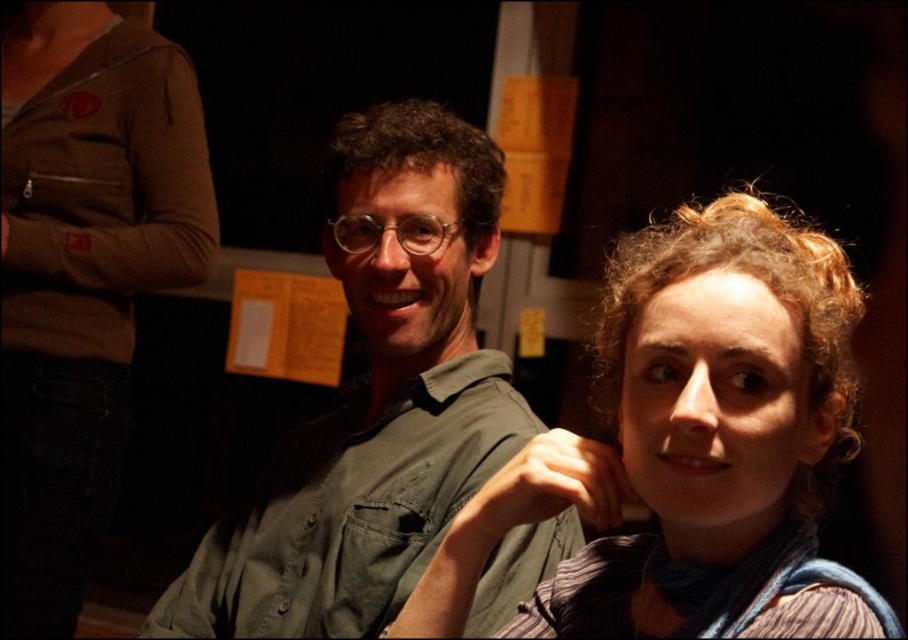
Between green matte shirt at center and curly hair at center, which one is positioned higher?

green matte shirt at center is higher up.

Find the location of a particular element. This screenshot has width=908, height=640. green matte shirt at center is located at coordinates (374, 401).

Where is `green matte shirt at center`? green matte shirt at center is located at coordinates (374, 401).

Is curly hair at center closer to the viewer compared to brown zippered jacket at upper left?

Yes, curly hair at center is in front of brown zippered jacket at upper left.

Who is more forward, [753,572] or [33,317]?

Point [753,572]

Locate an element on the screen. The width and height of the screenshot is (908, 640). curly hair at center is located at coordinates (721, 436).

Between green matte shirt at center and brown zippered jacket at upper left, which one is positioned higher?

brown zippered jacket at upper left is higher up.

Describe the element at coordinates (374, 401) in the screenshot. The height and width of the screenshot is (640, 908). I see `green matte shirt at center` at that location.

The image size is (908, 640). I want to click on green matte shirt at center, so click(x=374, y=401).